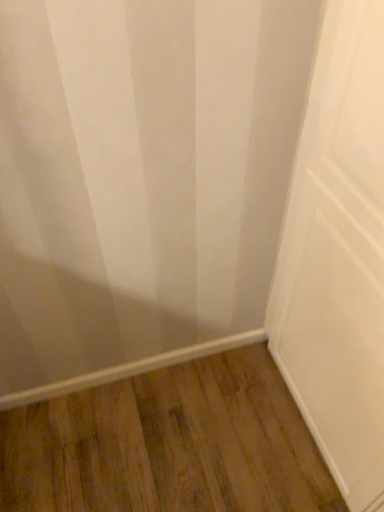
Find the location of a particular element. Image resolution: width=384 pixels, height=512 pixels. white matte door at center is located at coordinates (338, 256).

This screenshot has width=384, height=512. Describe the element at coordinates (338, 256) in the screenshot. I see `white matte door at center` at that location.

In order to face white matte door at center, should I rotate leftwards or rightwards?

To face it directly, rotate right by 20.593 degrees.

What do you see at coordinates (168, 445) in the screenshot? This screenshot has height=512, width=384. I see `brown wood flooring at lower center` at bounding box center [168, 445].

Identify the location of brown wood flooring at lower center. (168, 445).

Where is `white matte door at center`? white matte door at center is located at coordinates (338, 256).

Consider the image. Is white matte door at center to the right of brown wood flooring at lower center from the viewer's perspective?

Correct, you'll find white matte door at center to the right of brown wood flooring at lower center.

Is white matte door at center positioned before brown wood flooring at lower center?

Yes, white matte door at center is in front of brown wood flooring at lower center.

Does point (321, 393) lie behind point (292, 461)?

No, (321, 393) is in front of (292, 461).

From the image's perspective, who appears lower, white matte door at center or brown wood flooring at lower center?

From the image's view, brown wood flooring at lower center is below.

From a real-world perspective, between white matte door at center and brown wood flooring at lower center, who is vertically higher?

white matte door at center, from a real-world perspective.

Considering the sizes of white matte door at center and brown wood flooring at lower center in the image, is white matte door at center wider or thinner than brown wood flooring at lower center?

Considering their sizes, white matte door at center looks slimmer than brown wood flooring at lower center.

Between white matte door at center and brown wood flooring at lower center, which one has less height?

brown wood flooring at lower center.

Can you confirm if white matte door at center is smaller than brown wood flooring at lower center?

Actually, white matte door at center might be larger than brown wood flooring at lower center.

Consider the image. Is brown wood flooring at lower center surrounded by white matte door at center?

No, brown wood flooring at lower center is not inside white matte door at center.

Would you consider white matte door at center to be distant from brown wood flooring at lower center?

No.

Is white matte door at center looking in the opposite direction of brown wood flooring at lower center?

No, white matte door at center is not facing away from brown wood flooring at lower center.

How many degrees apart are the facing directions of white matte door at center and brown wood flooring at lower center?

They differ by 89.1 degrees in their facing directions.

Measure the distance between white matte door at center and brown wood flooring at lower center.

white matte door at center is 22.06 inches away from brown wood flooring at lower center.

I want to click on hardwood to the left of white matte door at center, so click(x=168, y=445).

Does brown wood flooring at lower center appear on the left side of white matte door at center?

Indeed, brown wood flooring at lower center is positioned on the left side of white matte door at center.

Which object is further away from the camera, brown wood flooring at lower center or white matte door at center?

Positioned behind is brown wood flooring at lower center.

Which is closer, (254, 378) or (349, 245)?

Point (254, 378) appears to be farther away from the viewer than point (349, 245).

From the image's perspective, relative to white matte door at center, is brown wood flooring at lower center above or below?

Clearly, from the image's perspective, brown wood flooring at lower center is below white matte door at center.

From a real-world perspective, which object rests below the other?

In real-world perspective, brown wood flooring at lower center is lower.

Which object is thinner, brown wood flooring at lower center or white matte door at center?

white matte door at center.

Based on the photo, can you confirm if brown wood flooring at lower center is shorter than white matte door at center?

Indeed, brown wood flooring at lower center has a lesser height compared to white matte door at center.

In terms of size, does brown wood flooring at lower center appear bigger or smaller than white matte door at center?

In the image, brown wood flooring at lower center appears to be smaller than white matte door at center.

Based on the photo, can we say brown wood flooring at lower center lies outside white matte door at center?

Yes.

Consider the image. Is there a large distance between brown wood flooring at lower center and white matte door at center?

Actually, brown wood flooring at lower center and white matte door at center are a little close together.

Does brown wood flooring at lower center turn towards white matte door at center?

No.

Can you tell me how much brown wood flooring at lower center and white matte door at center differ in facing direction?

brown wood flooring at lower center and white matte door at center are facing 89.1 degrees away from each other.

Locate an element on the screen. This screenshot has height=512, width=384. hardwood behind the white matte door at center is located at coordinates (168, 445).

Locate an element on the screen. hardwood that is on the left side of white matte door at center is located at coordinates (168, 445).

Locate an element on the screen. This screenshot has height=512, width=384. door above the brown wood flooring at lower center (from the image's perspective) is located at coordinates click(x=338, y=256).